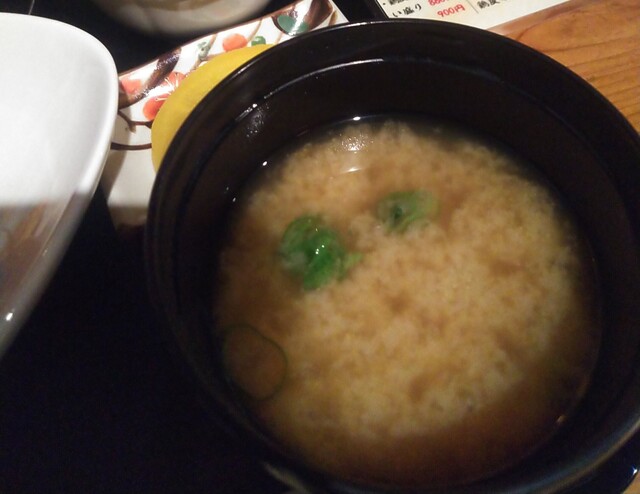
Locate an element on the screen. table surface is located at coordinates (602, 43).